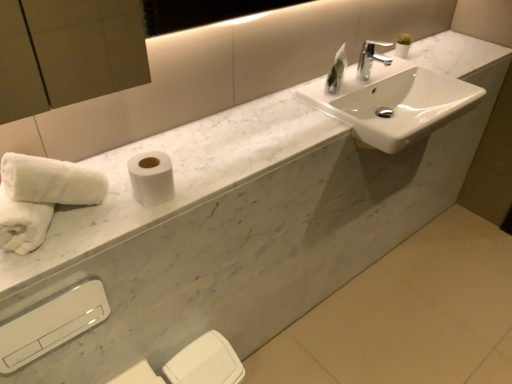
Question: Is white glossy sink at upper right taller than white glossy hand dryer at lower left?

Choices:
 (A) no
 (B) yes

Answer: (A)

Question: Considering the relative positions of white glossy sink at upper right and white glossy hand dryer at lower left in the image provided, is white glossy sink at upper right to the right of white glossy hand dryer at lower left from the viewer's perspective?

Choices:
 (A) no
 (B) yes

Answer: (B)

Question: Can you confirm if white glossy sink at upper right is wider than white glossy hand dryer at lower left?

Choices:
 (A) no
 (B) yes

Answer: (B)

Question: Does white glossy sink at upper right appear on the left side of white glossy hand dryer at lower left?

Choices:
 (A) no
 (B) yes

Answer: (A)

Question: Does white glossy sink at upper right touch white glossy hand dryer at lower left?

Choices:
 (A) no
 (B) yes

Answer: (A)

Question: Is white glossy sink at upper right positioned far away from white glossy hand dryer at lower left?

Choices:
 (A) no
 (B) yes

Answer: (B)

Question: Is white glossy hand dryer at lower left shorter than white fluffy towels at lower left?

Choices:
 (A) yes
 (B) no

Answer: (B)

Question: Is white glossy hand dryer at lower left next to white fluffy towels at lower left?

Choices:
 (A) no
 (B) yes

Answer: (A)

Question: Is white glossy hand dryer at lower left not inside white fluffy towels at lower left?

Choices:
 (A) yes
 (B) no

Answer: (A)

Question: From the image's perspective, is white glossy hand dryer at lower left above white fluffy towels at lower left?

Choices:
 (A) yes
 (B) no

Answer: (B)

Question: Is white glossy hand dryer at lower left thinner than white fluffy towels at lower left?

Choices:
 (A) yes
 (B) no

Answer: (A)

Question: Does white glossy hand dryer at lower left have a larger size compared to white fluffy towels at lower left?

Choices:
 (A) yes
 (B) no

Answer: (B)

Question: Is green glass vase at upper center bigger than white matte toilet paper at lower center, the 2th toilet paper viewed from the top?

Choices:
 (A) no
 (B) yes

Answer: (A)